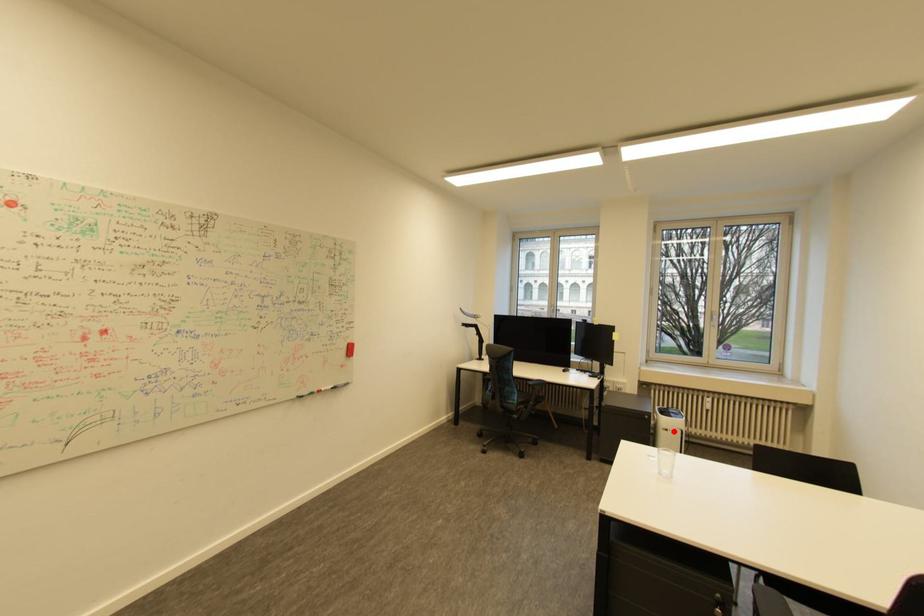
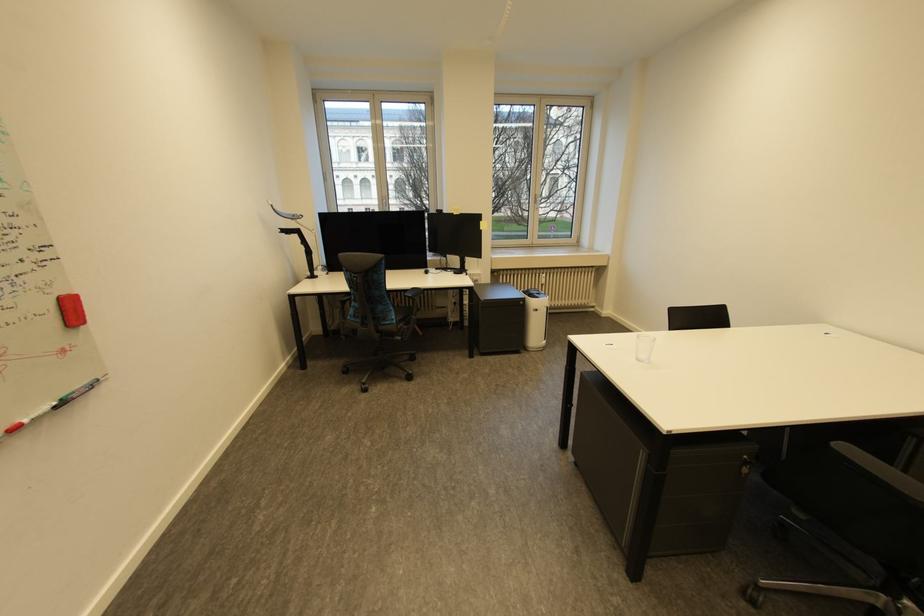
Question: A red point is marked in image1. In image2, is the corresponding 3D point closer to the camera or farther? Reply with the corresponding letter.

Choices:
 (A) The corresponding 3D point is closer.
 (B) The corresponding 3D point is farther.

Answer: (A)